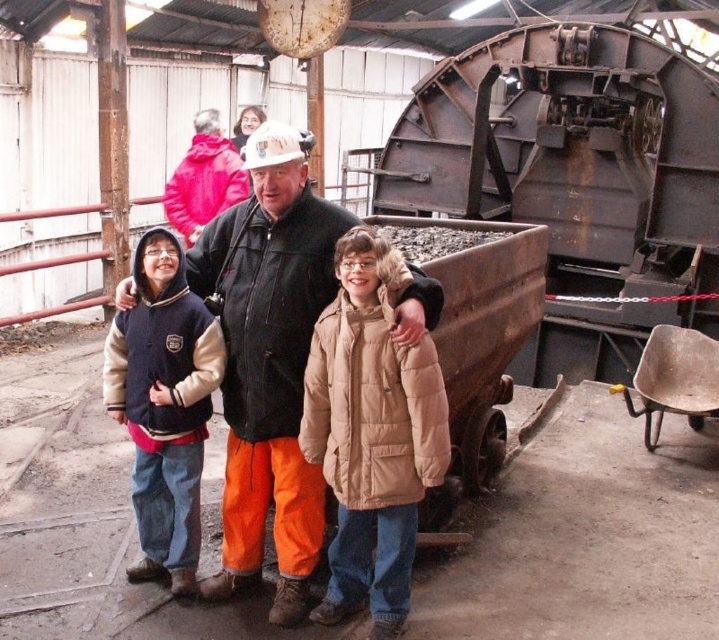
Does point (360, 388) come farther from viewer compared to point (187, 465)?

No, it is not.

Who is shorter, tan puffy coat at center or velvet navy jacket at left?

velvet navy jacket at left

Who is more distant from viewer, (429,442) or (214,324)?

The point (214,324) is more distant.

Locate an element on the screen. The image size is (719, 640). tan puffy coat at center is located at coordinates (370, 433).

Is matte black jacket at center taller than tan puffy coat at center?

Yes.

Which of these two, matte black jacket at center or tan puffy coat at center, stands taller?

Standing taller between the two is matte black jacket at center.

Where is `matte black jacket at center`? The width and height of the screenshot is (719, 640). matte black jacket at center is located at coordinates (270, 362).

Does matte black jacket at center appear under velvet navy jacket at left?

Actually, matte black jacket at center is above velvet navy jacket at left.

You are a GUI agent. You are given a task and a screenshot of the screen. Output one action in this format:
    pyautogui.click(x=<x>, y=<y>)
    Task: Click on the matte black jacket at center
    The image size is (719, 640).
    Given the screenshot: What is the action you would take?
    pyautogui.click(x=270, y=362)